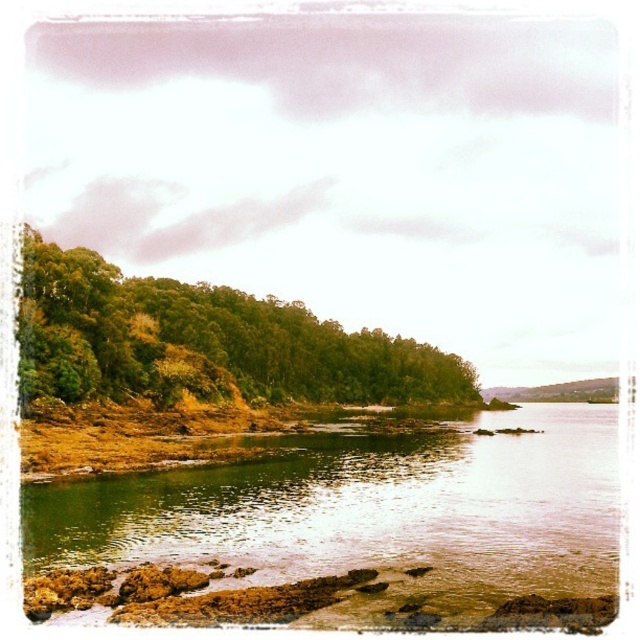
Question: Which point is farther from the camera taking this photo?

Choices:
 (A) (480, 490)
 (B) (234, 321)

Answer: (B)

Question: Which point is closer to the camera?

Choices:
 (A) (547, 540)
 (B) (333, 381)

Answer: (A)

Question: Is the position of green mossy rocks at lower left less distant than that of green leafy trees at left?

Choices:
 (A) yes
 (B) no

Answer: (A)

Question: Is green mossy rocks at lower left bigger than green leafy trees at left?

Choices:
 (A) no
 (B) yes

Answer: (A)

Question: Which point appears closest to the camera in this image?

Choices:
 (A) tap(68, 260)
 (B) tap(580, 564)

Answer: (B)

Question: Is green mossy rocks at lower left thinner than green leafy trees at left?

Choices:
 (A) no
 (B) yes

Answer: (B)